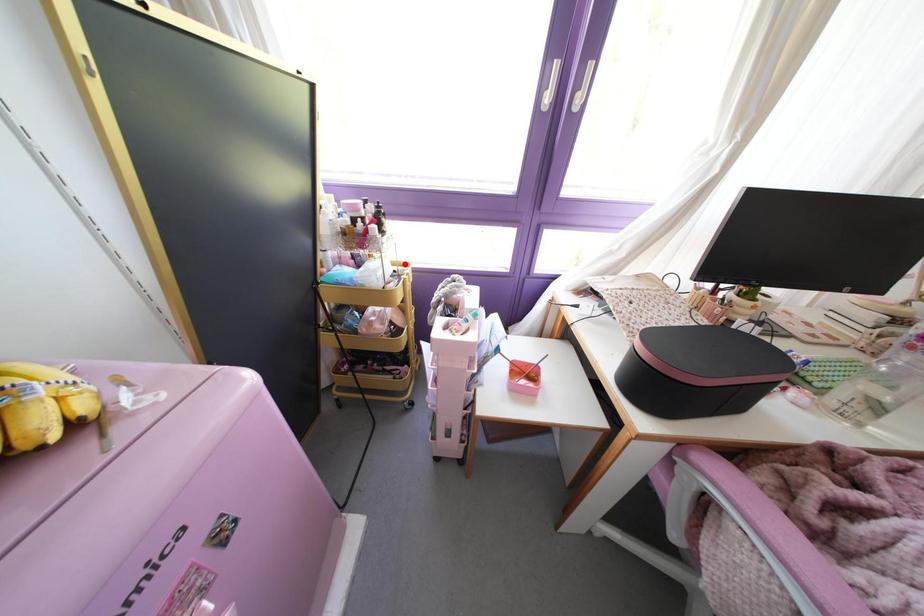
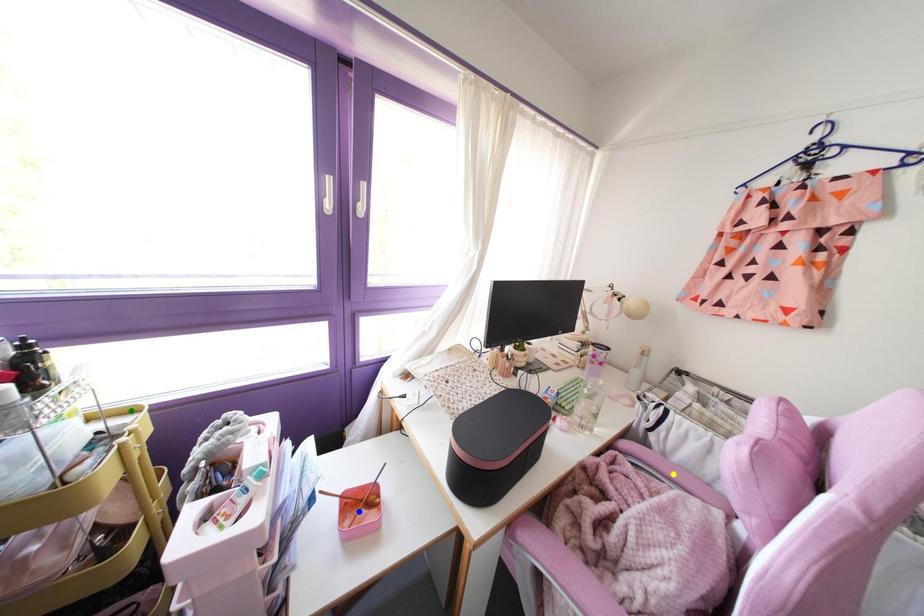
Question: I am providing you with two images of the same scene from different viewpoints. A red point is marked on the first image. You are given multiple points on the second image. Can you choose the point in image 2 that corresponds to the point in image 1?

Choices:
 (A) yellow point
 (B) green point
 (C) blue point

Answer: (B)